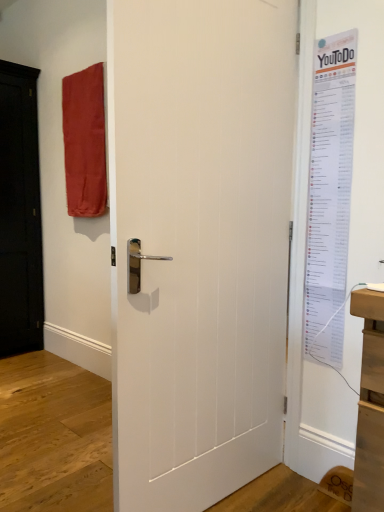
Question: In terms of height, does white paper poster at right look taller or shorter compared to white matte door at center?

Choices:
 (A) short
 (B) tall

Answer: (A)

Question: Is white paper poster at right spatially inside white matte door at center, or outside of it?

Choices:
 (A) outside
 (B) inside

Answer: (A)

Question: Which of these objects is positioned closest to the white matte door at center?

Choices:
 (A) white paper poster at right
 (B) matte red fabric at upper left

Answer: (A)

Question: Which object is positioned closest to the matte red fabric at upper left?

Choices:
 (A) white matte door at center
 (B) white paper poster at right

Answer: (A)